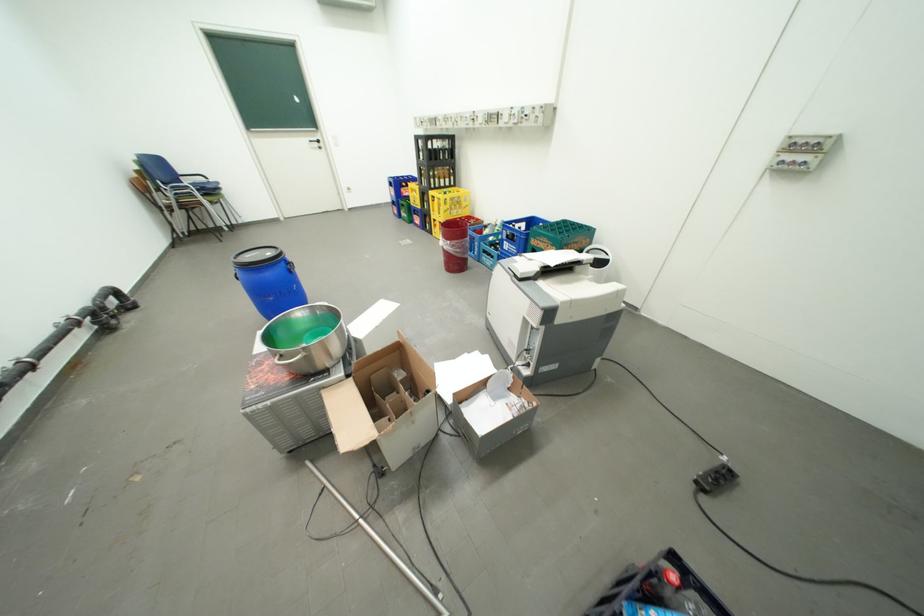
Identify the location of black door handle. Image resolution: width=924 pixels, height=616 pixels. (315, 142).